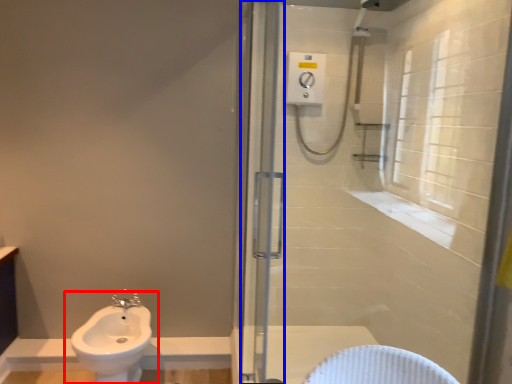
Question: Which object appears farthest to the camera in this image, sink (highlighted by a red box) or screen door (highlighted by a blue box)?

Choices:
 (A) sink
 (B) screen door

Answer: (A)